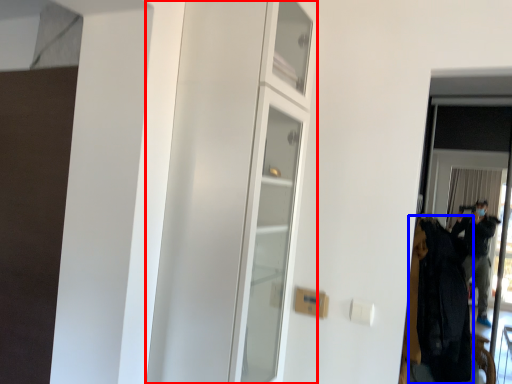
Question: Which object is further to the camera taking this photo, dresser (highlighted by a red box) or clothing (highlighted by a blue box)?

Choices:
 (A) dresser
 (B) clothing

Answer: (B)